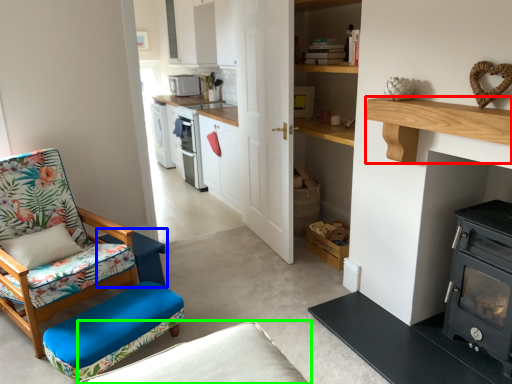
Question: Based on their relative distances, which object is nearer to shelf (highlighted by a red box)? Choose from table (highlighted by a blue box) and studio couch (highlighted by a green box).

Choices:
 (A) table
 (B) studio couch

Answer: (B)